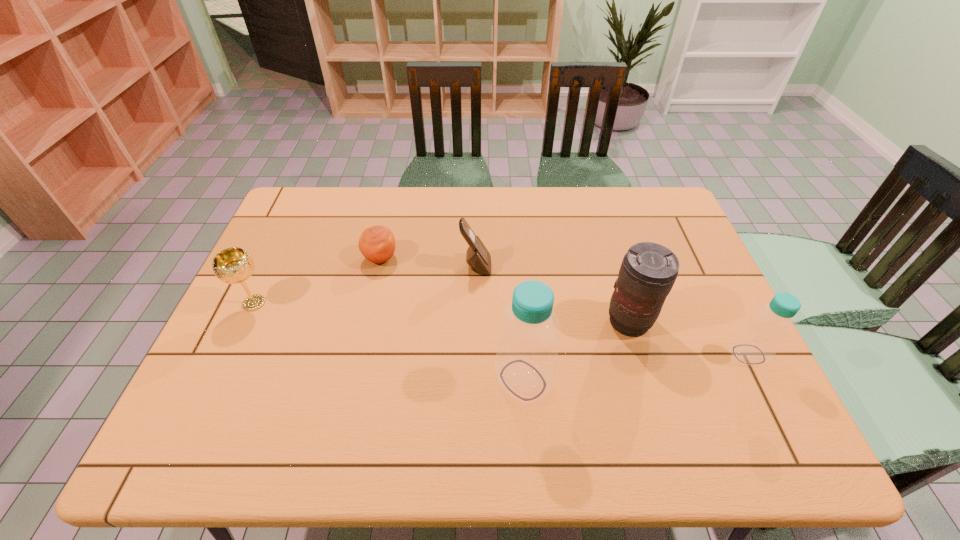
With all bottles evenly spaced, where should an extra bottle be placed on the left to continue the pattern? Please point out a vacant space. Please provide its 2D coordinates. Your answer should be formatted as a tuple, i.e. [(x, y)], where the tuple contains the x and y coordinates of a point satisfying the conditions above.

[(275, 408)]